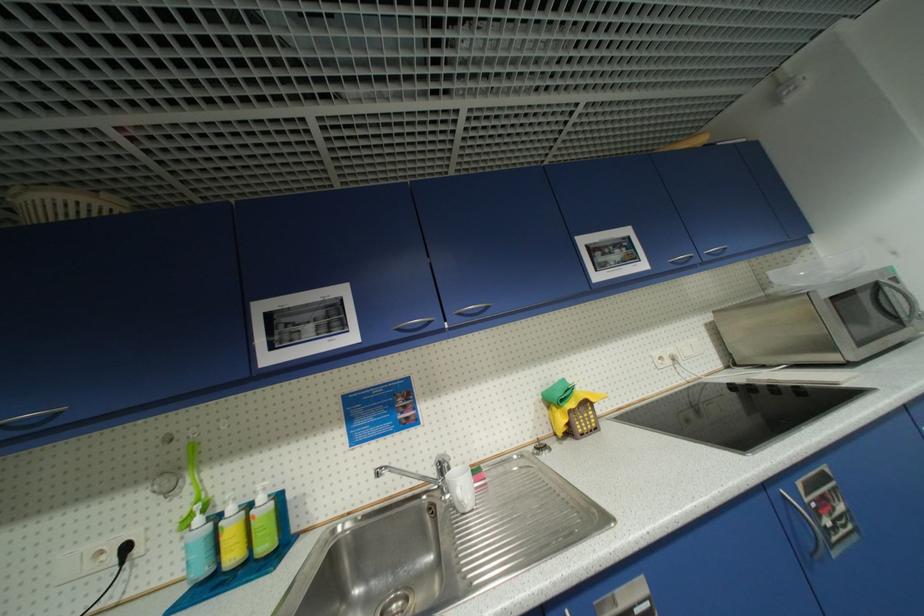
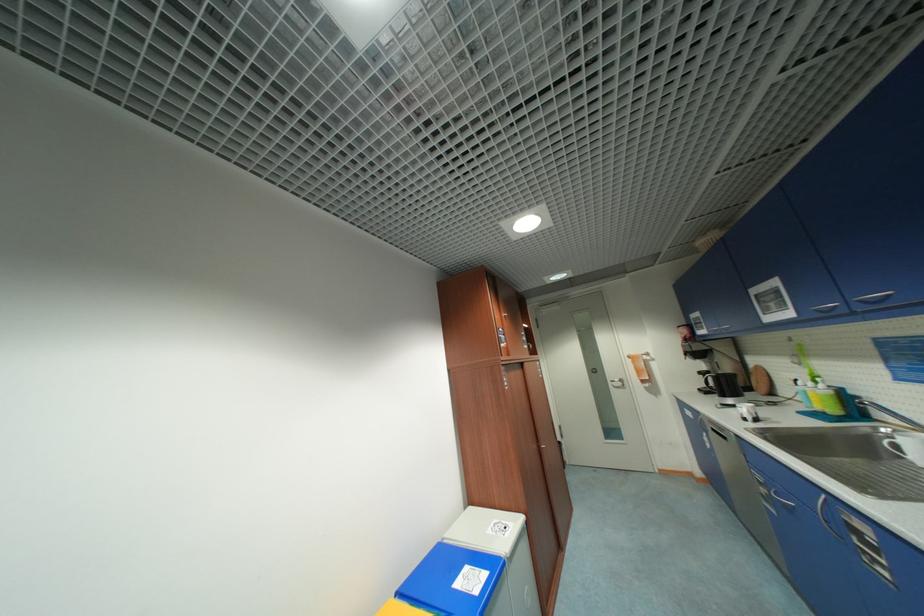
Where in the second image is the point corresponding to [405,331] from the first image?

(822, 312)